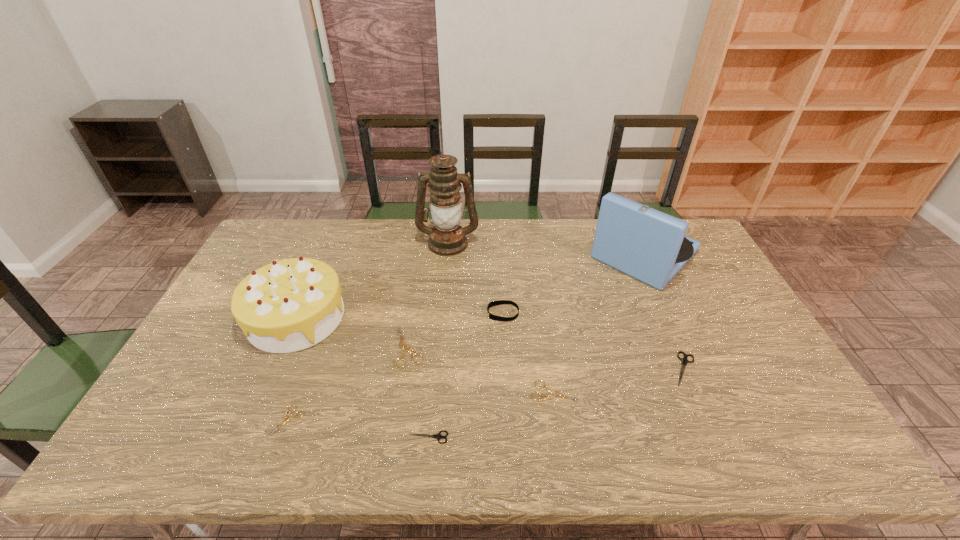
Find the location of a particular element. the tallest object is located at coordinates (447, 238).

You are a GUI agent. You are given a task and a screenshot of the screen. Output one action in this format:
    pyautogui.click(x=<x>, y=<y>)
    Task: Click on the phonograph record
    
    Given the screenshot: What is the action you would take?
    pyautogui.click(x=646, y=244)

Image resolution: width=960 pixels, height=540 pixels. Identify the location of blue phonograph record. (646, 244).

Where is `the seventh shortest object`? This screenshot has width=960, height=540. the seventh shortest object is located at coordinates (289, 305).

Locate an element on the screen. the fourth tallest object is located at coordinates (494, 303).

Where is `the sixth object from left to right`? This screenshot has width=960, height=540. the sixth object from left to right is located at coordinates (494, 303).

What are the coordinates of `the rightmost shears` in the screenshot? It's located at (684, 360).

At what (x,y) coordinates should I click in order to perform the action: click on the bigger black shears. Please return your answer as a coordinate pair (x, y). Looking at the image, I should click on (684, 360).

Find the location of a particular element. The height and width of the screenshot is (540, 960). the biggest beige shears is located at coordinates (403, 347).

This screenshot has height=540, width=960. I want to click on the second beige shears from right to left, so click(x=403, y=347).